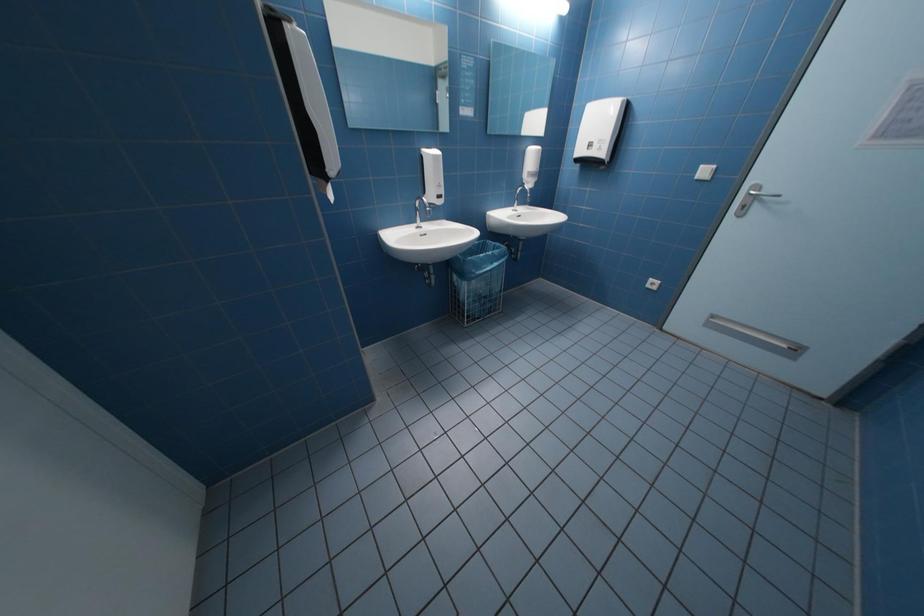
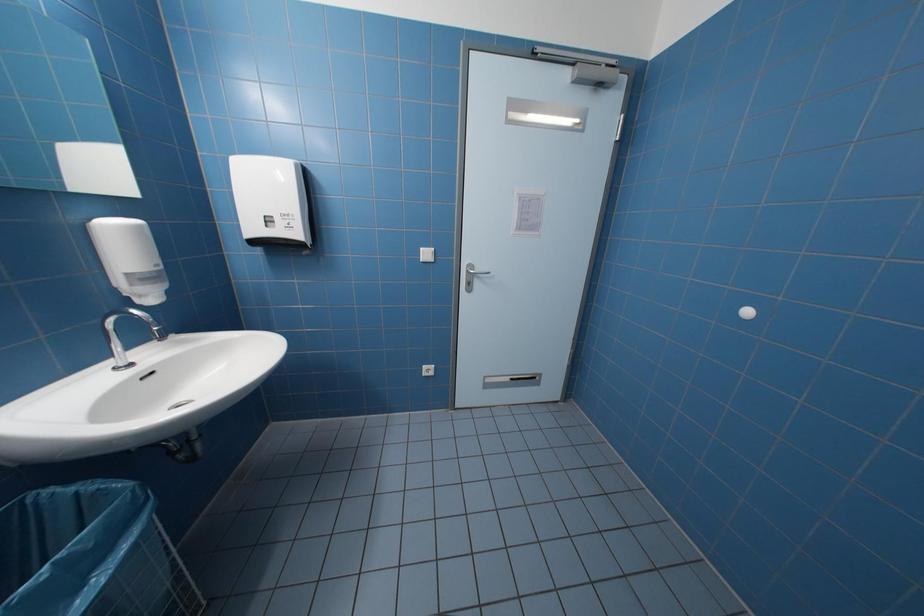
Question: The first image is from the beginning of the video and the second image is from the end. How did the camera likely rotate when shooting the video?

Choices:
 (A) Left
 (B) Right
 (C) Up
 (D) Down

Answer: (B)